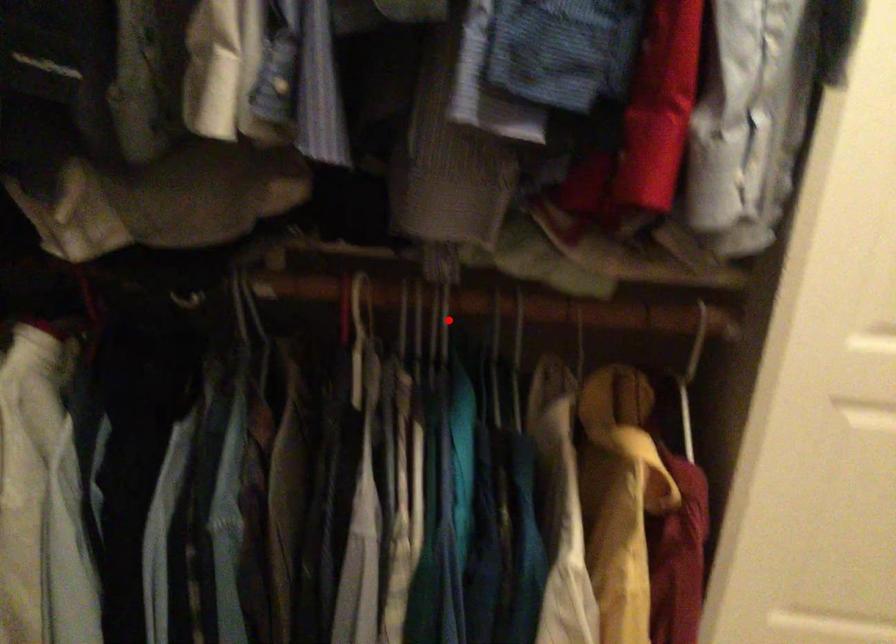
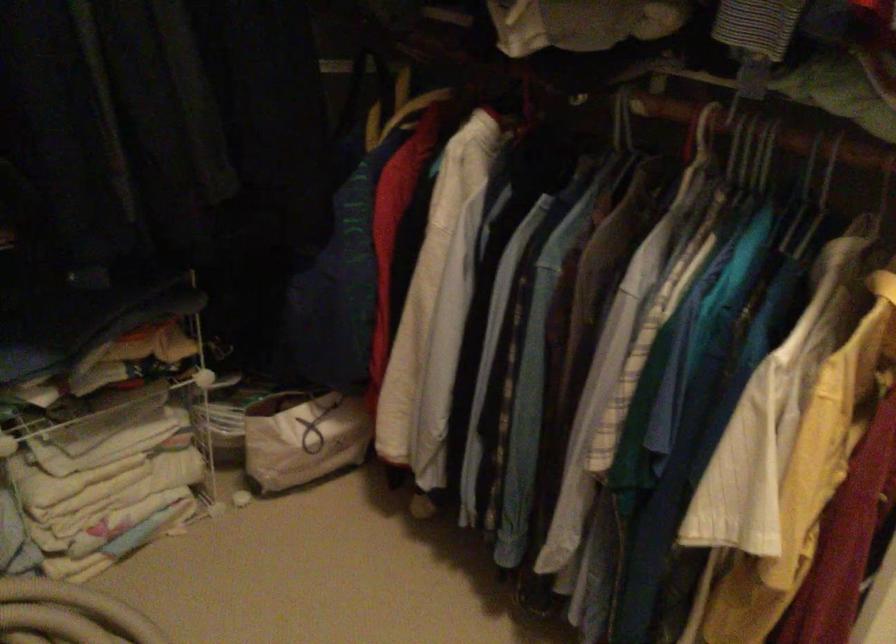
Locate, in the second image, the point that corresponds to the highlighted location in the first image.

(767, 154)